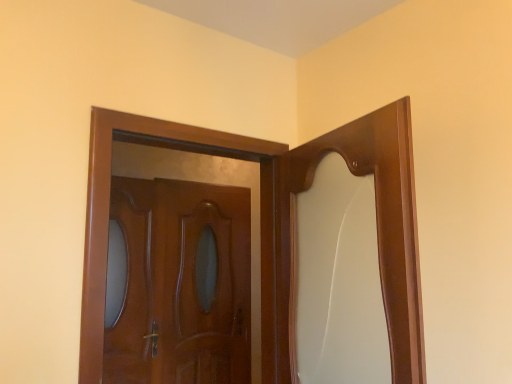
Question: From the image's perspective, is glossy wood door at center, which is counted as the 1th door, starting from the back, above or below glossy wood door at center, marked as the 1th door in a front-to-back arrangement?

Choices:
 (A) below
 (B) above

Answer: (A)

Question: Considering the positions of glossy wood door at center, which is counted as the 1th door, starting from the back, and glossy wood door at center, the 2th door positioned from the back, in the image, is glossy wood door at center, which is counted as the 1th door, starting from the back, taller or shorter than glossy wood door at center, the 2th door positioned from the back,?

Choices:
 (A) short
 (B) tall

Answer: (B)

Question: Is glossy wood door at center, which is counted as the 1th door, starting from the back, situated inside glossy wood door at center, marked as the 1th door in a front-to-back arrangement, or outside?

Choices:
 (A) inside
 (B) outside

Answer: (B)

Question: Relative to glossy wood door at center, which is counted as the 1th door, starting from the back, is glossy wood door at center, the 2th door positioned from the back, in front or behind?

Choices:
 (A) front
 (B) behind

Answer: (A)

Question: Considering the positions of glossy wood door at center, the 2th door positioned from the back, and glossy wood door at center, which is counted as the 1th door, starting from the back, in the image, is glossy wood door at center, the 2th door positioned from the back, wider or thinner than glossy wood door at center, which is counted as the 1th door, starting from the back,?

Choices:
 (A) thin
 (B) wide

Answer: (B)

Question: Based on their sizes in the image, would you say glossy wood door at center, marked as the 1th door in a front-to-back arrangement, is bigger or smaller than glossy wood door at center, which is the second door from front to back?

Choices:
 (A) big
 (B) small

Answer: (A)

Question: In terms of height, does glossy wood door at center, marked as the 1th door in a front-to-back arrangement, look taller or shorter compared to glossy wood door at center, which is counted as the 1th door, starting from the back?

Choices:
 (A) short
 (B) tall

Answer: (A)